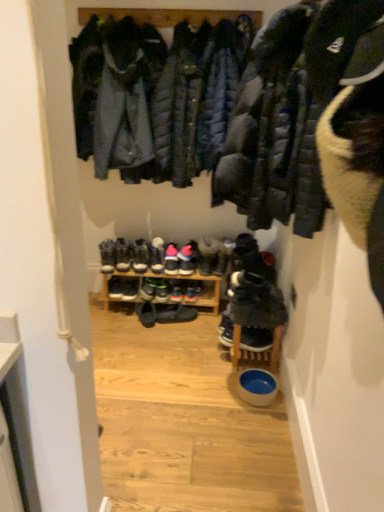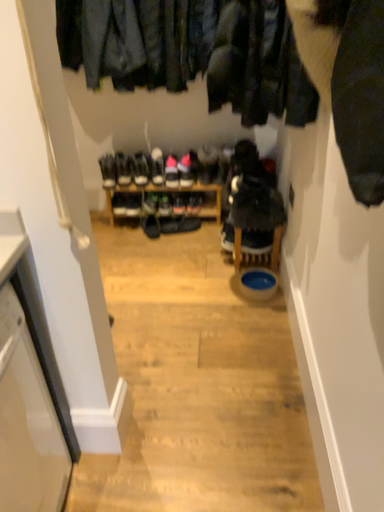
Question: Which way did the camera rotate in the video?

Choices:
 (A) rotated downward
 (B) rotated upward

Answer: (A)